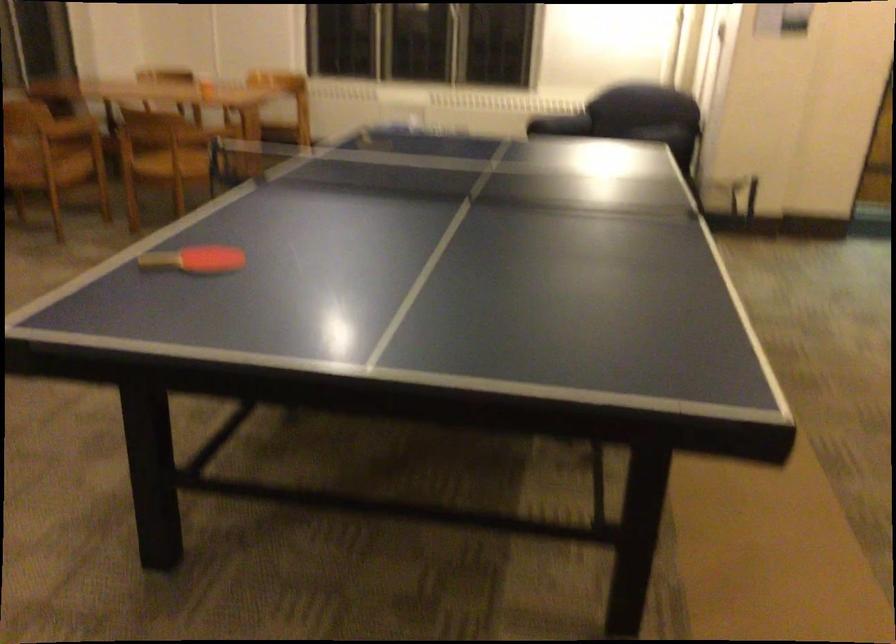
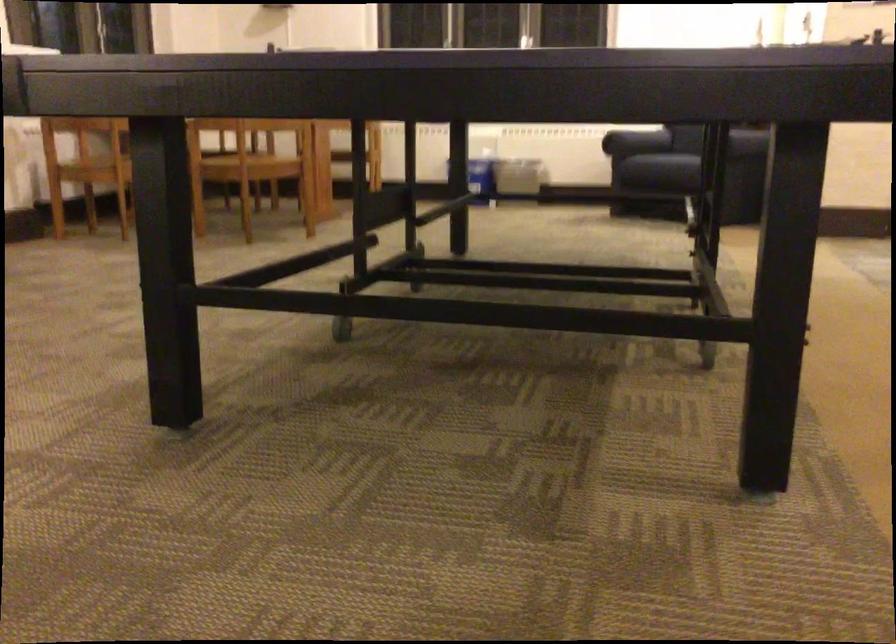
Question: I am providing you with two images of the same scene from different viewpoints. After the viewpoint changes to image2, which objects are now occluded?

Choices:
 (A) red ping-pong paddle
 (B) sofa armrest
 (C) sofa sitting surface
 (D) wire shelf basket

Answer: (A)